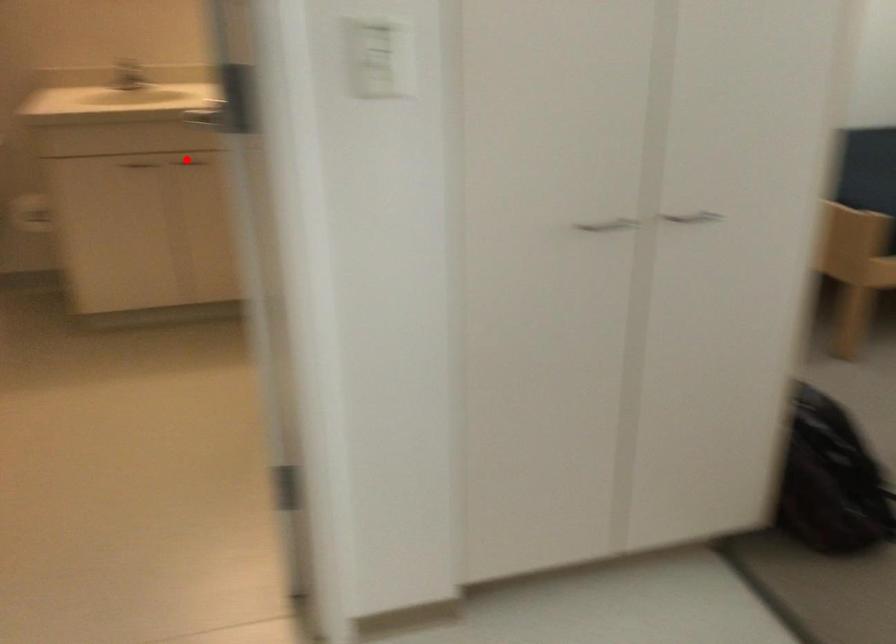
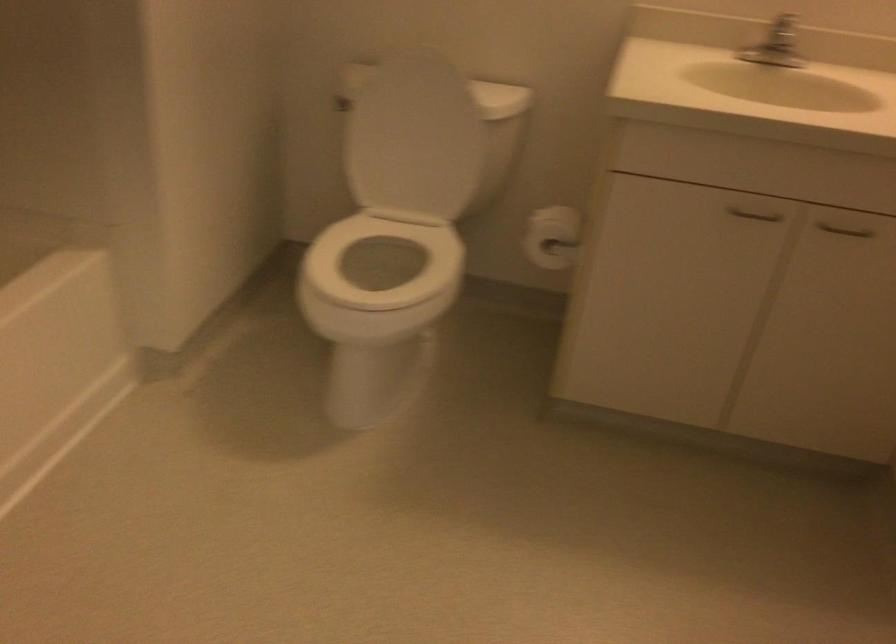
Question: I am providing you with two images of the same scene from different viewpoints. Image1 has a red point marked. In image2, the corresponding 3D location appears at what relative position? Reply with the corresponding letter.

Choices:
 (A) Closer
 (B) Farther

Answer: (A)